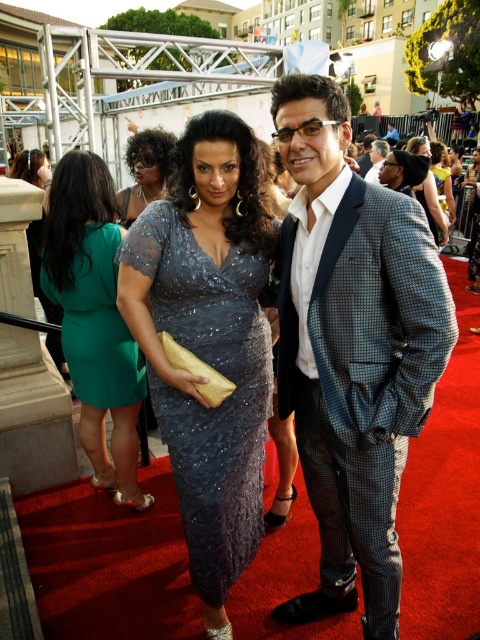
Does green satin dress at left have a lesser width compared to green lace dress at upper left?

Indeed, green satin dress at left has a lesser width compared to green lace dress at upper left.

Is point (110, 189) more distant than point (60, 308)?

No, (110, 189) is closer to viewer.

What are the coordinates of `green satin dress at left` in the screenshot? It's located at (95, 317).

The image size is (480, 640). In order to click on checkered wool suit at center in this screenshot , I will do `click(352, 349)`.

Is checkered wool suit at center shorter than satin sequined dress at center?

No.

Does point (403, 204) lie in front of point (245, 387)?

Yes, it is.

The height and width of the screenshot is (640, 480). I want to click on checkered wool suit at center, so click(352, 349).

Does checkered wool suit at center lie behind green satin dress at left?

No, it is in front of green satin dress at left.

Is point (322, 577) more distant than point (79, 164)?

No, (322, 577) is in front of (79, 164).

Is point (447, 355) closer to camera compared to point (84, 179)?

That is True.

Find the location of `checkered wool suit at center`. checkered wool suit at center is located at coordinates (352, 349).